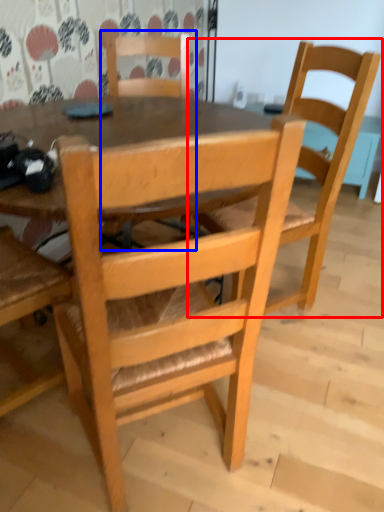
Question: Among these objects, which one is farthest to the camera, chair (highlighted by a red box) or chair (highlighted by a blue box)?

Choices:
 (A) chair
 (B) chair

Answer: (B)